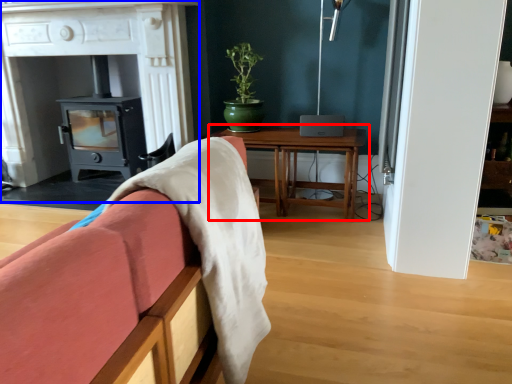
Question: Which object appears closest to the camera in this image, table (highlighted by a red box) or fireplace (highlighted by a blue box)?

Choices:
 (A) table
 (B) fireplace

Answer: (B)